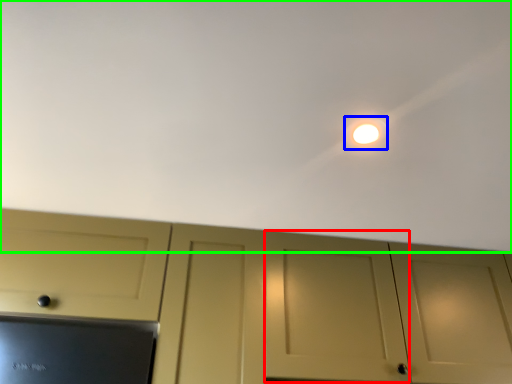
Question: Estimate the real-world distances between objects in this image. Which object is farther from door (highlighted by a red box), light (highlighted by a blue box) or backdrop (highlighted by a green box)?

Choices:
 (A) light
 (B) backdrop

Answer: (A)